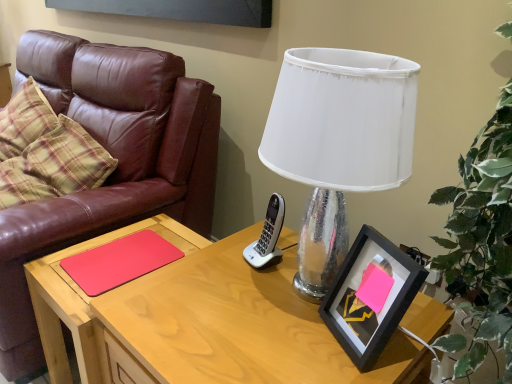
Question: Does wooden desk at center come behind brown leather couch at left?

Choices:
 (A) yes
 (B) no

Answer: (B)

Question: Does wooden desk at center appear on the left side of brown leather couch at left?

Choices:
 (A) yes
 (B) no

Answer: (B)

Question: Is wooden desk at center facing towards brown leather couch at left?

Choices:
 (A) yes
 (B) no

Answer: (B)

Question: Considering the relative sizes of wooden desk at center and brown leather couch at left in the image provided, is wooden desk at center wider than brown leather couch at left?

Choices:
 (A) no
 (B) yes

Answer: (A)

Question: From a real-world perspective, is wooden desk at center positioned over brown leather couch at left based on gravity?

Choices:
 (A) no
 (B) yes

Answer: (A)

Question: Would you say brown leather couch at left is part of wooden desk at center's contents?

Choices:
 (A) yes
 (B) no

Answer: (B)

Question: From a real-world perspective, is white fabric lampshade at upper center over brown leather couch at left?

Choices:
 (A) no
 (B) yes

Answer: (B)

Question: Is white fabric lampshade at upper center wider than brown leather couch at left?

Choices:
 (A) no
 (B) yes

Answer: (A)

Question: Does white fabric lampshade at upper center touch brown leather couch at left?

Choices:
 (A) yes
 (B) no

Answer: (B)

Question: Is white fabric lampshade at upper center facing towards brown leather couch at left?

Choices:
 (A) no
 (B) yes

Answer: (A)

Question: Is white fabric lampshade at upper center positioned beyond the bounds of brown leather couch at left?

Choices:
 (A) yes
 (B) no

Answer: (A)

Question: Is white fabric lampshade at upper center at the left side of brown leather couch at left?

Choices:
 (A) yes
 (B) no

Answer: (B)

Question: Does white fabric lampshade at upper center have a larger size compared to black matte picture frame at right?

Choices:
 (A) yes
 (B) no

Answer: (A)